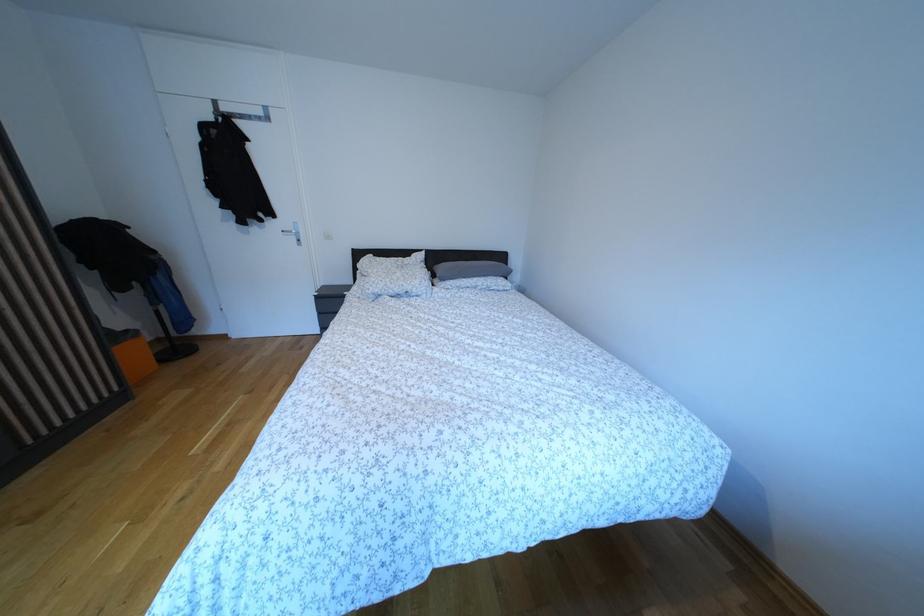
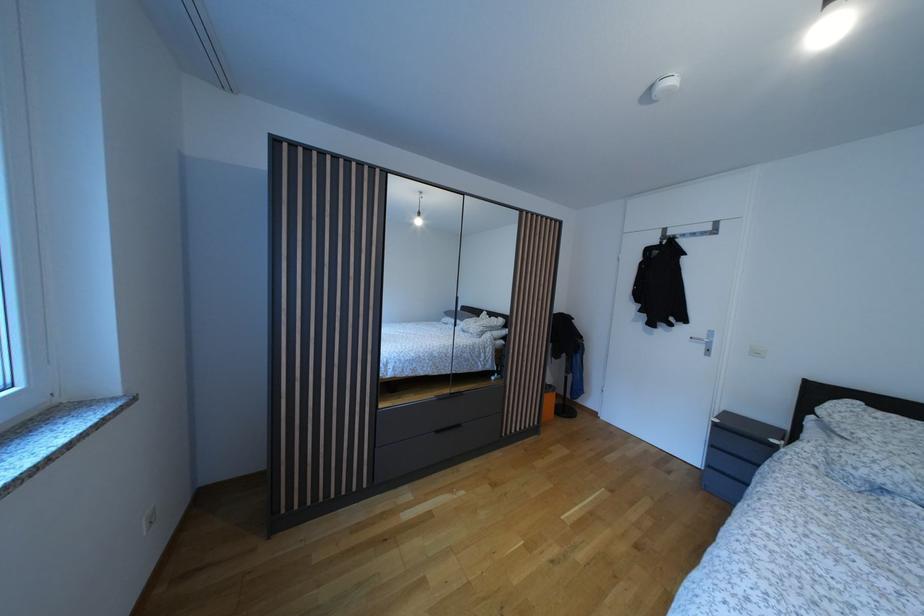
Question: The images are taken continuously from a first-person perspective. In which direction is your viewpoint rotating?

Choices:
 (A) Left
 (B) Right
 (C) Up
 (D) Down

Answer: (A)